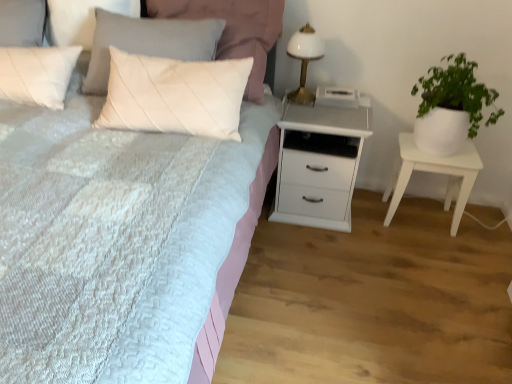
Identify the location of vacant space in front of white wood chest of drawers at center. This screenshot has width=512, height=384. (325, 257).